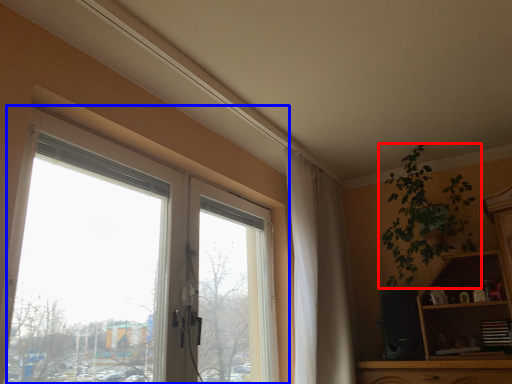
Question: Which of the following is the farthest to the observer, houseplant (highlighted by a red box) or window (highlighted by a blue box)?

Choices:
 (A) houseplant
 (B) window

Answer: (A)